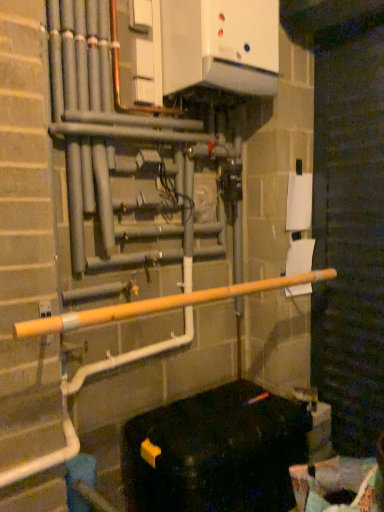
Identify the location of black plastic container at lower right. The height and width of the screenshot is (512, 384). (215, 452).

What do you see at coordinates (215, 452) in the screenshot? This screenshot has height=512, width=384. I see `black plastic container at lower right` at bounding box center [215, 452].

Identify the location of recycled cardboard box at lower right. This screenshot has width=384, height=512. (338, 485).

This screenshot has width=384, height=512. I want to click on recycling bin located underneath the yellow matte pipe at center (from a real-world perspective), so click(x=338, y=485).

Is recycled cardboard box at lower right oriented towards yellow matte pipe at center?

No, recycled cardboard box at lower right does not turn towards yellow matte pipe at center.

Is the depth of recycled cardboard box at lower right greater than that of yellow matte pipe at center?

Yes, the depth of recycled cardboard box at lower right is greater than that of yellow matte pipe at center.

Can you confirm if recycled cardboard box at lower right is positioned to the right of yellow matte pipe at center?

Yes, recycled cardboard box at lower right is to the right of yellow matte pipe at center.

Considering the positions of objects recycled cardboard box at lower right and black plastic container at lower right in the image provided, who is more to the left, recycled cardboard box at lower right or black plastic container at lower right?

black plastic container at lower right.

Does recycled cardboard box at lower right have a larger size compared to black plastic container at lower right?

No.

Is point (251, 395) less distant than point (291, 280)?

No, (251, 395) is behind (291, 280).

Based on the photo, does black plastic container at lower right come behind yellow matte pipe at center?

Yes, it is behind yellow matte pipe at center.

Where is `rail above the black plastic container at lower right (from the image's perspective)`? This screenshot has width=384, height=512. rail above the black plastic container at lower right (from the image's perspective) is located at coordinates (161, 304).

Considering the positions of objects black plastic container at lower right and yellow matte pipe at center in the image provided, who is more to the left, black plastic container at lower right or yellow matte pipe at center?

From the viewer's perspective, yellow matte pipe at center appears more on the left side.

Who is taller, yellow matte pipe at center or recycled cardboard box at lower right?

Standing taller between the two is recycled cardboard box at lower right.

Is yellow matte pipe at center wider than recycled cardboard box at lower right?

→ No, yellow matte pipe at center is not wider than recycled cardboard box at lower right.

Could you tell me if yellow matte pipe at center is turned towards recycled cardboard box at lower right?

No, yellow matte pipe at center is not facing towards recycled cardboard box at lower right.

Is yellow matte pipe at center positioned beyond the bounds of recycled cardboard box at lower right?

Yes.

Can you tell me how much black plastic container at lower right and recycled cardboard box at lower right differ in facing direction?

black plastic container at lower right and recycled cardboard box at lower right are facing 22.5 degrees away from each other.

Can you confirm if black plastic container at lower right is positioned to the right of recycled cardboard box at lower right?

No.

Is point (178, 488) more distant than point (376, 490)?

Yes, point (178, 488) is farther from viewer.

Is black plastic container at lower right oriented away from recycled cardboard box at lower right?

No.

Is yellow matte pipe at center looking in the opposite direction of black plastic container at lower right?

No, black plastic container at lower right is not at the back of yellow matte pipe at center.

Locate an element on the screen. This screenshot has width=384, height=512. furniture below the yellow matte pipe at center (from the image's perspective) is located at coordinates (215, 452).

In the image, is yellow matte pipe at center positioned in front of or behind black plastic container at lower right?

yellow matte pipe at center is in front of black plastic container at lower right.

Which object is positioned more to the right, yellow matte pipe at center or black plastic container at lower right?

black plastic container at lower right.

At what (x,y) coordinates should I click in order to perform the action: click on rail above the recycled cardboard box at lower right (from the image's perspective). Please return your answer as a coordinate pair (x, y). Looking at the image, I should click on (161, 304).

Find the location of a particular element. The height and width of the screenshot is (512, 384). recycling bin lying on the right of black plastic container at lower right is located at coordinates (338, 485).

Estimate the real-world distances between objects in this image. Which object is closer to black plastic container at lower right, recycled cardboard box at lower right or yellow matte pipe at center?

Among the two, recycled cardboard box at lower right is located nearer to black plastic container at lower right.

Based on their spatial positions, is yellow matte pipe at center or recycled cardboard box at lower right further from black plastic container at lower right?

The object further to black plastic container at lower right is yellow matte pipe at center.

Considering their positions, is recycled cardboard box at lower right positioned closer to yellow matte pipe at center than black plastic container at lower right?

The object closer to yellow matte pipe at center is black plastic container at lower right.

Which object lies further to the anchor point recycled cardboard box at lower right, black plastic container at lower right or yellow matte pipe at center?

Among the two, yellow matte pipe at center is located further to recycled cardboard box at lower right.

Based on their spatial positions, is black plastic container at lower right or recycled cardboard box at lower right further from yellow matte pipe at center?

Based on the image, recycled cardboard box at lower right appears to be further to yellow matte pipe at center.

Considering their positions, is yellow matte pipe at center positioned further to recycled cardboard box at lower right than black plastic container at lower right?

The object further to recycled cardboard box at lower right is yellow matte pipe at center.

This screenshot has width=384, height=512. I want to click on furniture between yellow matte pipe at center and recycled cardboard box at lower right in the vertical direction, so click(215, 452).